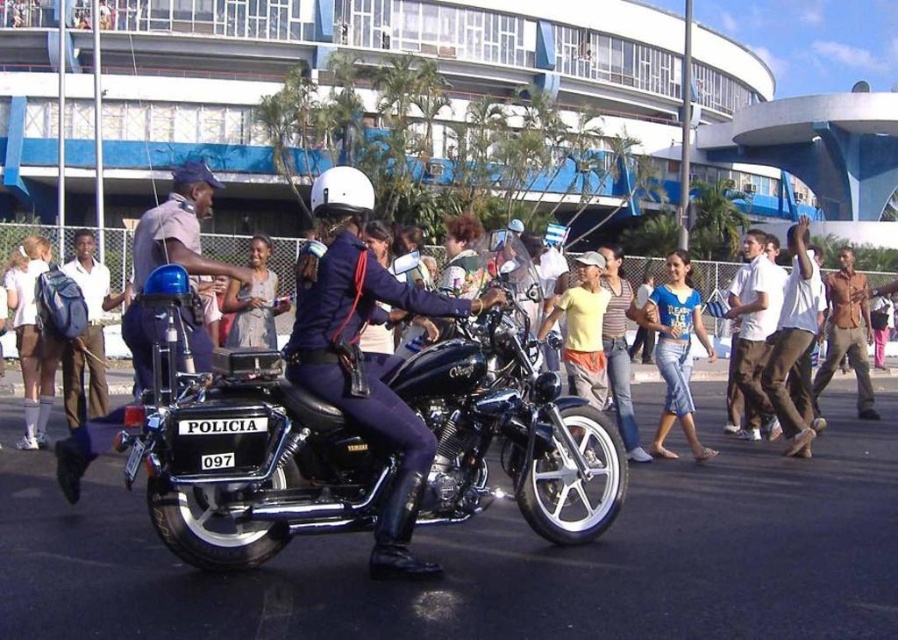
You are a pedestrian standing on the sidewalk and see the shiny black motorcycle at center and the white cotton shirt at right. Which object is closer to the ground?

The shiny black motorcycle at center is closer to the ground because it is positioned below the white cotton shirt at right.

You are a tailor who needs to determine which item requires more fabric based on their size. Given that you see the shiny blue uniform at center and the brown cotton pants at right in the image, which one would need more fabric?

The shiny blue uniform at center requires more fabric because its width is larger than the brown cotton pants at right.